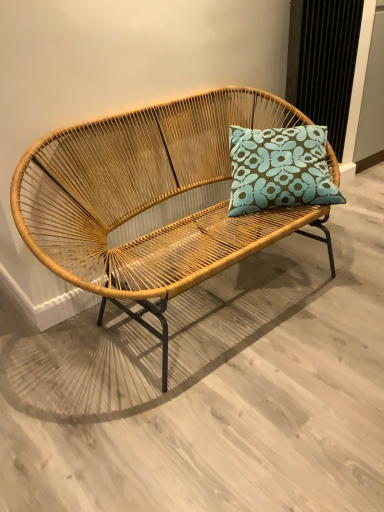
Find the location of a particular element. The image size is (384, 512). vacant area situated below natural woven studio couch at center (from a real-world perspective) is located at coordinates (215, 309).